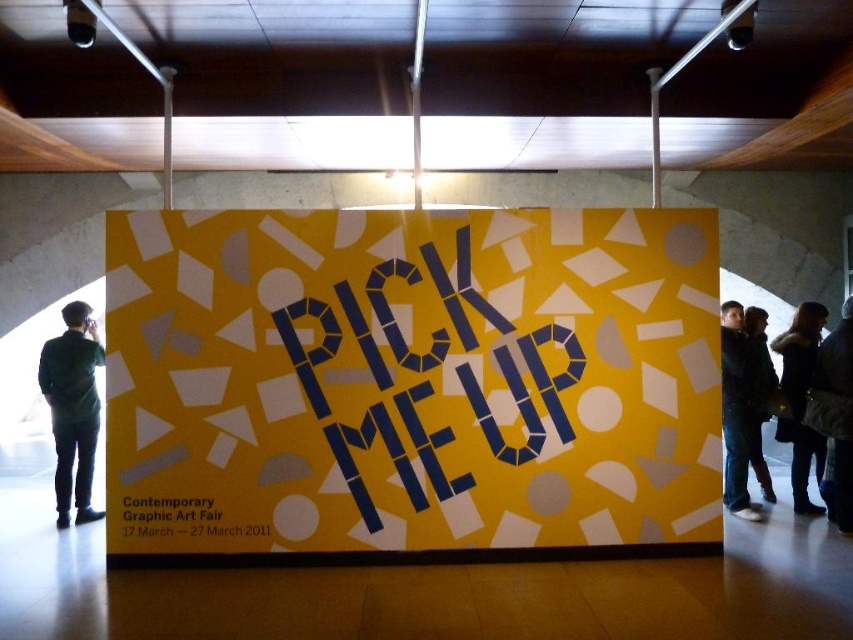
You are an event organizer arranging items for the Contemporary Graphic Art Fair. You have a blue paper at center and a dark green shirt at left. According to the spatial arrangement, which object is positioned to the right of the other?

The blue paper at center is positioned to the right of the dark green shirt at left.

You are an art collector at the Contemporary Graphic Art Fair. You see the dark blue leather jacket at right and the black paper at lower left. Which object is positioned to the right of the other?

The dark blue leather jacket at right is to the right of the black paper at lower left.